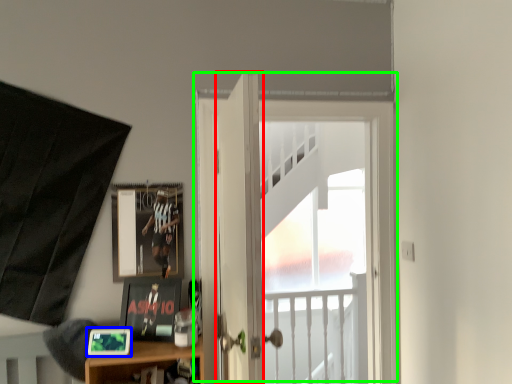
Question: Which is farther away from door (highlighted by a red box)? picture frame (highlighted by a blue box) or door (highlighted by a green box)?

Choices:
 (A) picture frame
 (B) door

Answer: (A)